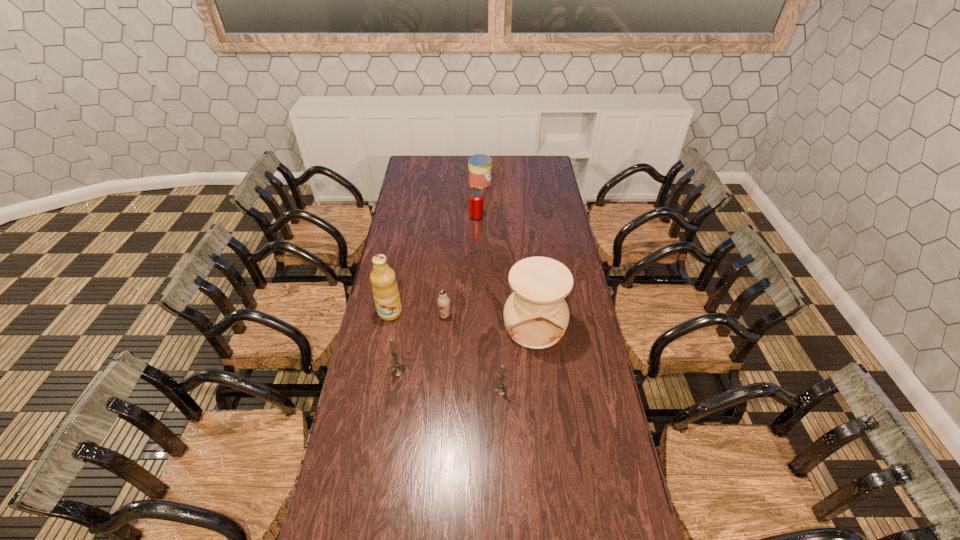
The height and width of the screenshot is (540, 960). In the image, there is a desktop. Identify the location of vacant space at the near edge. (424, 528).

Where is `free space at the left edge of the desktop`? This screenshot has height=540, width=960. free space at the left edge of the desktop is located at coordinates (409, 238).

This screenshot has height=540, width=960. Find the location of `free spot at the right edge of the desktop`. free spot at the right edge of the desktop is located at coordinates (539, 187).

In the image, there is a desktop. Where is `free space at the far left corner`? The image size is (960, 540). free space at the far left corner is located at coordinates (x=417, y=165).

In the image, there is a desktop. Where is `vacant region at the far right corner`? This screenshot has height=540, width=960. vacant region at the far right corner is located at coordinates (535, 170).

The image size is (960, 540). In order to click on free space that is in between the olive oil and the right candle in this screenshot , I will do `click(445, 352)`.

You are a GUI agent. You are given a task and a screenshot of the screen. Output one action in this format:
    pyautogui.click(x=<x>, y=<y>)
    Task: Click on the free point between the fifth shortest object and the third object from left to right
    The width and height of the screenshot is (960, 540).
    Given the screenshot: What is the action you would take?
    pyautogui.click(x=421, y=343)

You are a GUI agent. You are given a task and a screenshot of the screen. Output one action in this format:
    pyautogui.click(x=<x>, y=<y>)
    Task: Click on the empty space that is in between the farthest object and the chocolate milk
    The height and width of the screenshot is (540, 960).
    Given the screenshot: What is the action you would take?
    pyautogui.click(x=463, y=249)

Find the location of a particular element. free space between the shorter candle and the left candle is located at coordinates (449, 380).

The width and height of the screenshot is (960, 540). In order to click on vacant area between the shorter candle and the farther can in this screenshot , I will do tap(491, 286).